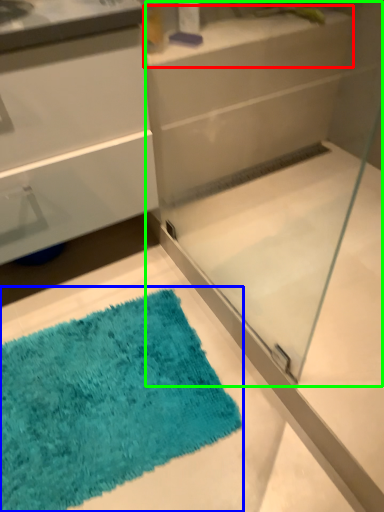
Question: Based on their relative distances, which object is nearer to counter top (highlighted by a red box)? Choose from bath mat (highlighted by a blue box) and glass box (highlighted by a green box).

Choices:
 (A) bath mat
 (B) glass box

Answer: (B)